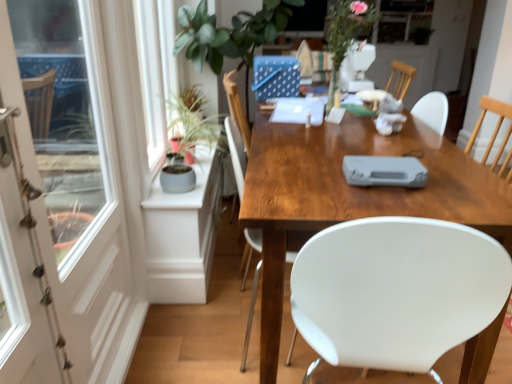
Question: From a real-world perspective, relative to metallic silver screen door at left, placed as the 2th screen door when sorted from left to right, is wooden desk at center vertically above or below?

Choices:
 (A) above
 (B) below

Answer: (B)

Question: Is wooden desk at center bigger or smaller than metallic silver screen door at left, which is the 1th screen door from right to left?

Choices:
 (A) small
 (B) big

Answer: (B)

Question: Based on their relative distances, which object is farther from the white glossy screen door at left, marked as the 2th screen door in a right-to-left arrangement?

Choices:
 (A) floral arrangement at upper center
 (B) wooden desk at center
 (C) white plastic game console at center
 (D) metallic silver screen door at left, placed as the 2th screen door when sorted from left to right

Answer: (A)

Question: Which is nearer to the wooden desk at center?

Choices:
 (A) metallic silver screen door at left, which is the 1th screen door from right to left
 (B) white plastic game console at center
 (C) floral arrangement at upper center
 (D) white glossy screen door at left, acting as the 1th screen door starting from the left

Answer: (B)